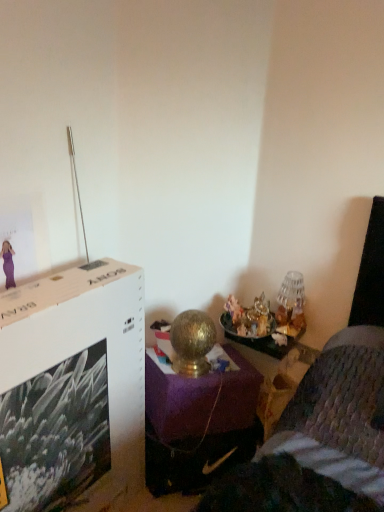
Question: Is the position of white cardboard file cabinet at upper left more distant than that of gold metallic table at center?

Choices:
 (A) no
 (B) yes

Answer: (A)

Question: Does white cardboard file cabinet at upper left have a lesser height compared to gold metallic table at center?

Choices:
 (A) yes
 (B) no

Answer: (B)

Question: Is white cardboard file cabinet at upper left smaller than gold metallic table at center?

Choices:
 (A) yes
 (B) no

Answer: (B)

Question: Are white cardboard file cabinet at upper left and gold metallic table at center beside each other?

Choices:
 (A) yes
 (B) no

Answer: (B)

Question: Is white cardboard file cabinet at upper left positioned with its back to gold metallic table at center?

Choices:
 (A) no
 (B) yes

Answer: (A)

Question: Can you confirm if white cardboard file cabinet at upper left is thinner than gold metallic table at center?

Choices:
 (A) yes
 (B) no

Answer: (A)

Question: Does gold metallic table at center appear on the right side of white cardboard file cabinet at upper left?

Choices:
 (A) no
 (B) yes

Answer: (B)

Question: Considering the relative sizes of gold metallic table at center and white cardboard file cabinet at upper left in the image provided, is gold metallic table at center wider than white cardboard file cabinet at upper left?

Choices:
 (A) no
 (B) yes

Answer: (B)

Question: From a real-world perspective, is gold metallic table at center physically below white cardboard file cabinet at upper left?

Choices:
 (A) yes
 (B) no

Answer: (A)

Question: Would you say white cardboard file cabinet at upper left is part of gold metallic table at center's contents?

Choices:
 (A) yes
 (B) no

Answer: (B)

Question: Is gold metallic table at center in front of white cardboard file cabinet at upper left?

Choices:
 (A) no
 (B) yes

Answer: (A)

Question: Are gold metallic table at center and white cardboard file cabinet at upper left beside each other?

Choices:
 (A) no
 (B) yes

Answer: (A)

Question: Is gold metallic table lamp at right surrounded by white cardboard file cabinet at upper left?

Choices:
 (A) yes
 (B) no

Answer: (B)